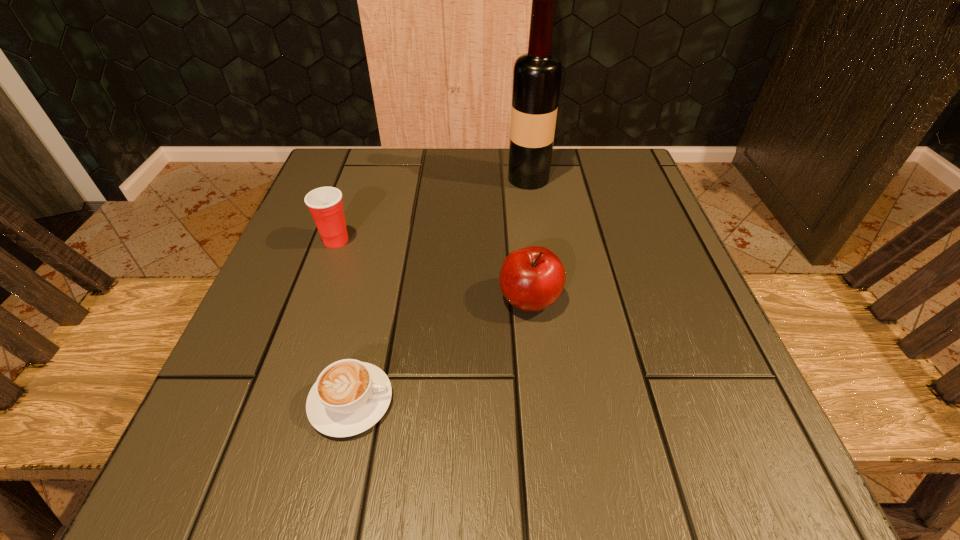
Identify the location of the tallest object. (537, 74).

Locate an element on the screen. This screenshot has height=540, width=960. the farthest object is located at coordinates (537, 74).

Where is `the second nearest object`? The height and width of the screenshot is (540, 960). the second nearest object is located at coordinates (532, 278).

The width and height of the screenshot is (960, 540). I want to click on the leftmost object, so click(x=325, y=204).

The height and width of the screenshot is (540, 960). Find the location of `Dixie cup`. Dixie cup is located at coordinates (325, 204).

Where is `the shortest object`? This screenshot has width=960, height=540. the shortest object is located at coordinates (349, 397).

This screenshot has width=960, height=540. In order to click on the nearest object in this screenshot , I will do `click(349, 397)`.

Locate an element on the screen. free space located on the front of the farthest object is located at coordinates (539, 254).

Where is `free space located on the back of the third farthest object`? This screenshot has height=540, width=960. free space located on the back of the third farthest object is located at coordinates click(516, 164).

What are the coordinates of `free spot located 0.230m on the back of the leftmost object` in the screenshot? It's located at (362, 168).